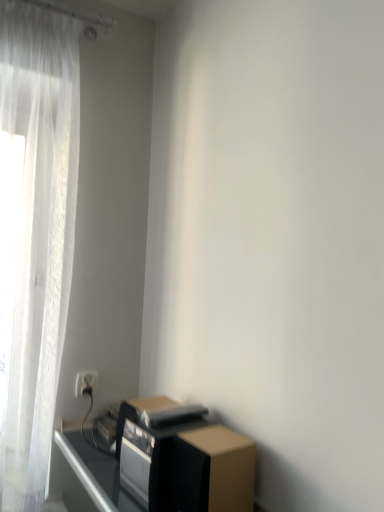
You are a GUI agent. You are given a task and a screenshot of the screen. Output one action in this format:
    pyautogui.click(x=<x>, y=<y>)
    Task: Click on the black matte speaker at lower right
    The width and height of the screenshot is (384, 512).
    Given the screenshot: What is the action you would take?
    pyautogui.click(x=161, y=464)

Are white plastic electric outlet at lower left and brown cardboard box at lower right making contact?

white plastic electric outlet at lower left is not next to brown cardboard box at lower right, and they're not touching.

Locate an element on the screen. cardboard box in front of the white plastic electric outlet at lower left is located at coordinates (227, 467).

Is white plastic electric outlet at lower left looking in the opposite direction of brown cardboard box at lower right?

No, white plastic electric outlet at lower left is not facing away from brown cardboard box at lower right.

From a real-world perspective, who is located lower, white plastic electric outlet at lower left or black matte speaker at lower right?

In real-world perspective, black matte speaker at lower right is lower.

Does white plastic electric outlet at lower left turn towards black matte speaker at lower right?

Yes, white plastic electric outlet at lower left faces towards black matte speaker at lower right.

Does black matte speaker at lower right have a lesser height compared to brown cardboard box at lower right?

Indeed, black matte speaker at lower right has a lesser height compared to brown cardboard box at lower right.

Is black matte speaker at lower right oriented away from brown cardboard box at lower right?

black matte speaker at lower right does not have its back to brown cardboard box at lower right.

Which point is more distant from viewer, (176, 473) or (238, 489)?

The point (176, 473) is farther from the camera.

Do you think black matte speaker at lower right is within brown cardboard box at lower right, or outside of it?

black matte speaker at lower right is not inside brown cardboard box at lower right, it's outside.

From a real-world perspective, is brown cardboard box at lower right physically located above or below white plastic electric outlet at lower left?

brown cardboard box at lower right is below white plastic electric outlet at lower left.

Does point (244, 464) come behind point (94, 377)?

No, it is in front of (94, 377).

Between brown cardboard box at lower right and white plastic electric outlet at lower left, which one appears on the right side from the viewer's perspective?

Positioned to the right is brown cardboard box at lower right.

Between brown cardboard box at lower right and white plastic electric outlet at lower left, which one has more height?

brown cardboard box at lower right is taller.

Considering the relative positions of brown cardboard box at lower right and black matte speaker at lower right in the image provided, is brown cardboard box at lower right to the left of black matte speaker at lower right from the viewer's perspective?

Incorrect, brown cardboard box at lower right is not on the left side of black matte speaker at lower right.

From the image's perspective, is brown cardboard box at lower right above or below black matte speaker at lower right?

Clearly, from the image's perspective, brown cardboard box at lower right is above black matte speaker at lower right.

Who is taller, brown cardboard box at lower right or black matte speaker at lower right?

brown cardboard box at lower right is taller.

Which is less distant, (130,490) or (83,378)?

Positioned in front is point (130,490).

This screenshot has width=384, height=512. I want to click on appliance in front of the white plastic electric outlet at lower left, so click(161, 464).

Which is in front, black matte speaker at lower right or white plastic electric outlet at lower left?

black matte speaker at lower right.

Could you tell me if black matte speaker at lower right is turned towards white plastic electric outlet at lower left?

No, black matte speaker at lower right is not turned towards white plastic electric outlet at lower left.

Where is `electric outlet located behind the brown cardboard box at lower right`? This screenshot has height=512, width=384. electric outlet located behind the brown cardboard box at lower right is located at coordinates (86, 382).

What are the coordinates of `appliance below the white plastic electric outlet at lower left (from the image's perspective)` in the screenshot? It's located at (161, 464).

Looking at the image, which one is located closer to black matte speaker at lower right, brown cardboard box at lower right or white plastic electric outlet at lower left?

Among the two, brown cardboard box at lower right is located nearer to black matte speaker at lower right.

Looking at the image, which one is located further to black matte speaker at lower right, white plastic electric outlet at lower left or brown cardboard box at lower right?

Based on the image, white plastic electric outlet at lower left appears to be further to black matte speaker at lower right.

Considering their positions, is black matte speaker at lower right positioned closer to brown cardboard box at lower right than white plastic electric outlet at lower left?

black matte speaker at lower right is positioned closer to the anchor brown cardboard box at lower right.

Looking at the image, which one is located closer to white plastic electric outlet at lower left, brown cardboard box at lower right or black matte speaker at lower right?

Based on the image, black matte speaker at lower right appears to be nearer to white plastic electric outlet at lower left.

Looking at the image, which one is located further to brown cardboard box at lower right, white plastic electric outlet at lower left or black matte speaker at lower right?

white plastic electric outlet at lower left lies further to brown cardboard box at lower right than the other object.

Estimate the real-world distances between objects in this image. Which object is further from white plastic electric outlet at lower left, black matte speaker at lower right or brown cardboard box at lower right?

brown cardboard box at lower right is positioned further to the anchor white plastic electric outlet at lower left.

Locate an element on the screen. This screenshot has height=512, width=384. appliance located between brown cardboard box at lower right and white plastic electric outlet at lower left in the depth direction is located at coordinates (161, 464).